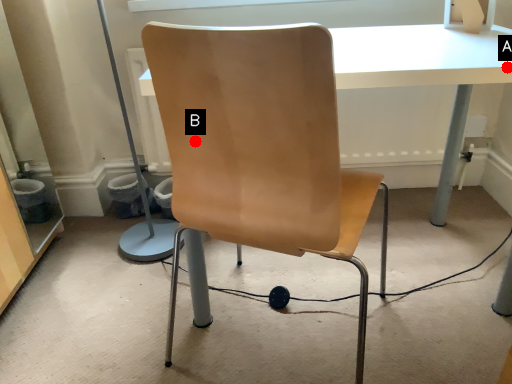
Question: Two points are circled on the image, labeled by A and B beside each circle. Which point appears closest to the camera in this image?

Choices:
 (A) A is closer
 (B) B is closer

Answer: (B)